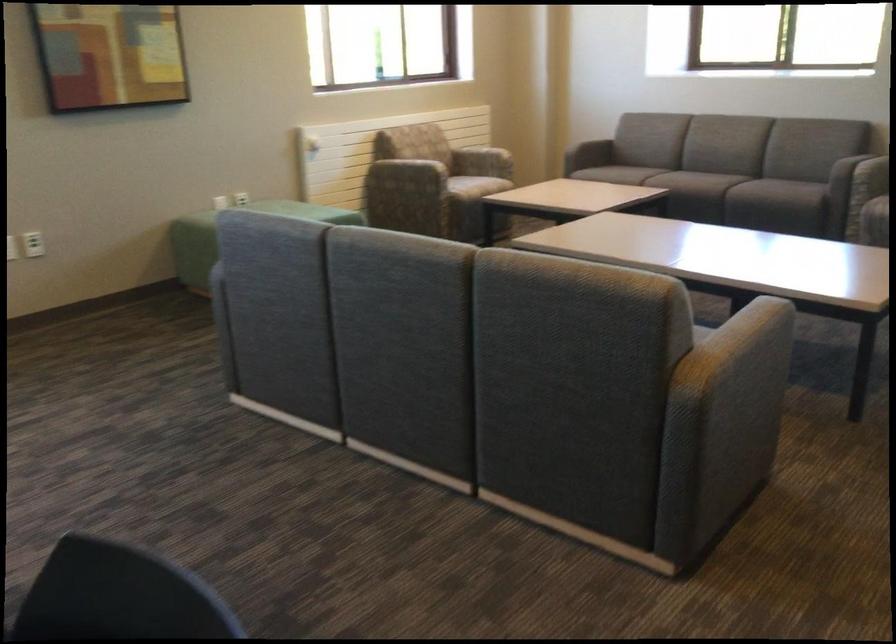
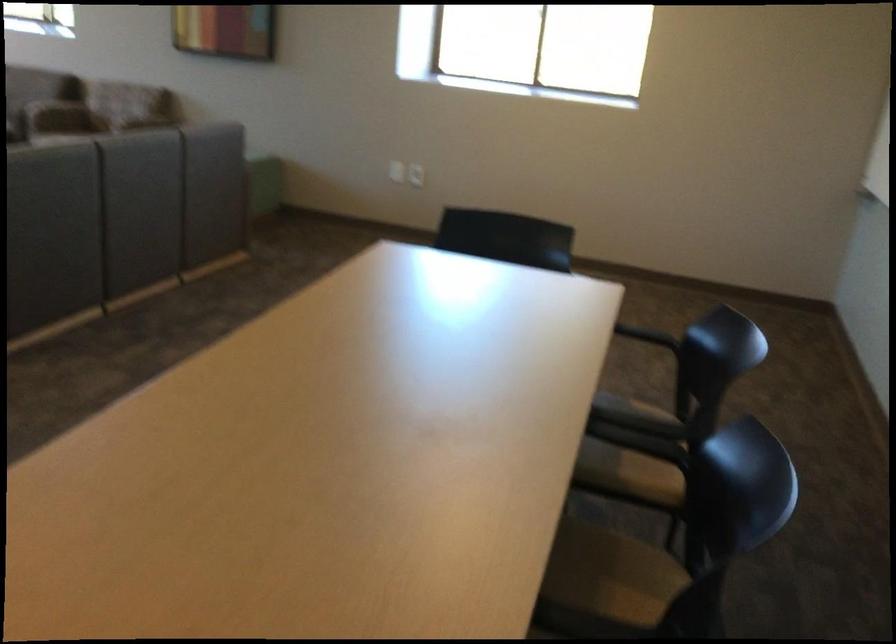
What movement of the cameraman would produce the second image?

The movement direction of the cameraman is right, backward.